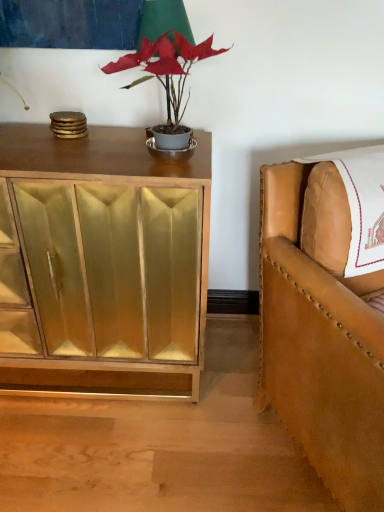
Where is `blank space to the left of matte gray pot at center`? blank space to the left of matte gray pot at center is located at coordinates (74, 152).